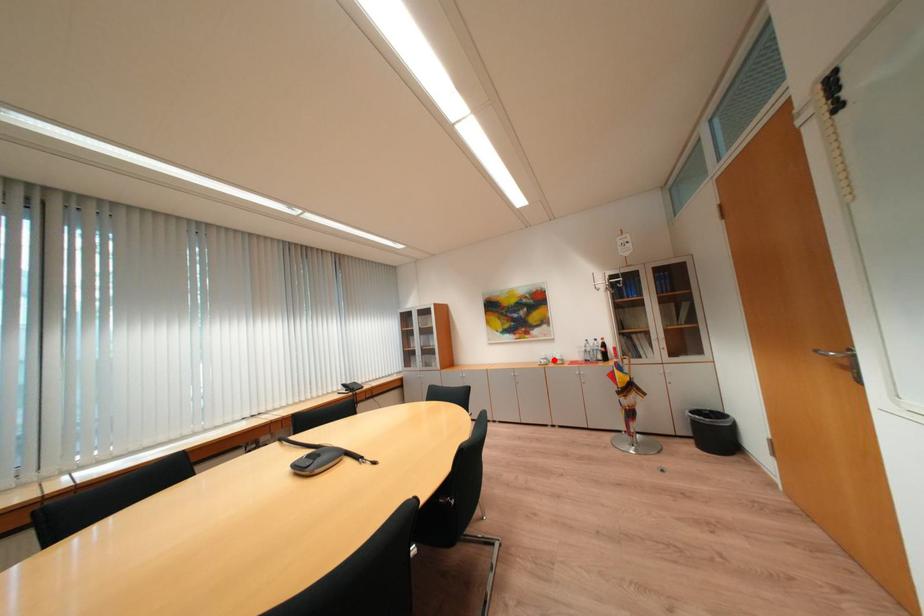
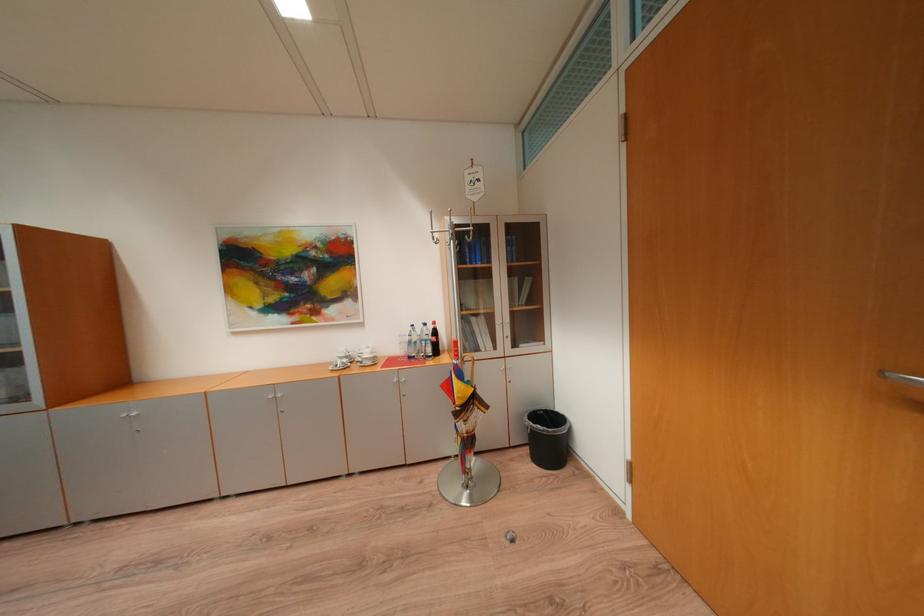
Locate, in the second image, the point that corresponds to the highlighted location in the first image.

(355, 359)